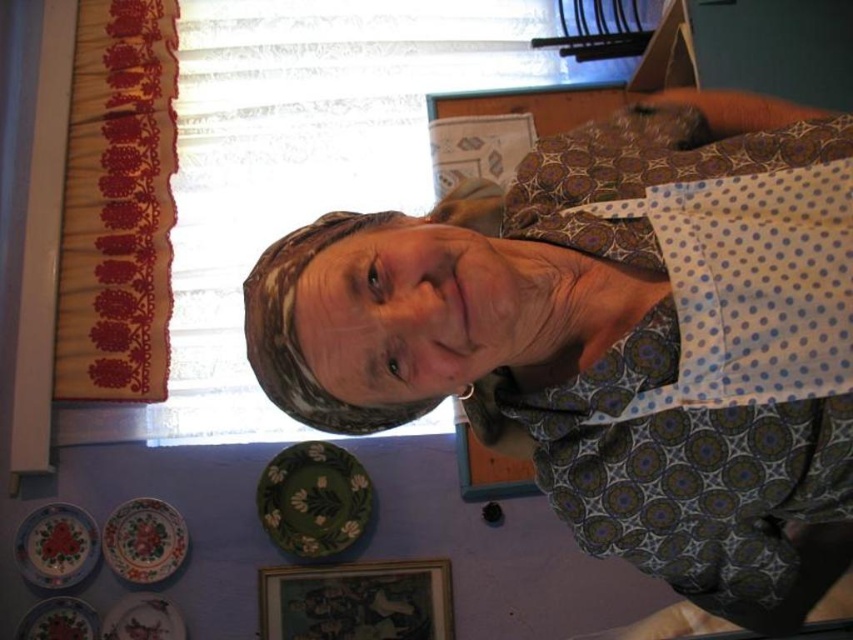
What is the exact coordinate of the green matte plate at lower left?

The green matte plate at lower left is located at point (314, 499).

You are arranging a dinner table and need to place a green matte plate at lower left. The coordinates given are point [314,499]. If the table is a standard size of 6 feet long and 3 feet wide, can you confirm if the green matte plate at lower left will fit within the table dimensions?

The green matte plate at lower left is located at coordinates point [314,499], which is within the standard table dimensions of 6 feet long and 3 feet wide. Therefore, it will fit.

You are a tailor working on a project and need to determine the spatial relationship between the polka dot fabric at upper center and the matte ceramic plate at lower left. Which object is positioned higher in the image?

The polka dot fabric at upper center is taller than the matte ceramic plate at lower left, so it is positioned higher in the image.